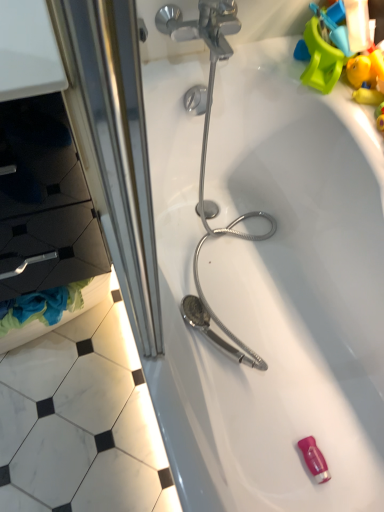
At what (x,y) coordinates should I click in order to perform the action: click on white glossy bathtub at center. Please return your answer as a coordinate pair (x, y). Looking at the image, I should click on (270, 286).

What do you see at coordinates (270, 286) in the screenshot?
I see `white glossy bathtub at center` at bounding box center [270, 286].

In order to face black matte drawer at left, should I rotate leftwards or rightwards?

Turn left by 22.912 degrees to look at black matte drawer at left.

This screenshot has width=384, height=512. Identify the location of black matte drawer at left. (45, 202).

What do you see at coordinates (45, 202) in the screenshot?
I see `black matte drawer at left` at bounding box center [45, 202].

I want to click on white glossy bathtub at center, so click(x=270, y=286).

Is black matte drawer at left to the left or to the right of white glossy bathtub at center in the image?

black matte drawer at left is to the left of white glossy bathtub at center.

Which object is further away from the camera, black matte drawer at left or white glossy bathtub at center?

white glossy bathtub at center is further away from the camera.

Considering the positions of point (30, 157) and point (221, 116), is point (30, 157) closer or farther from the camera than point (221, 116)?

Clearly, point (30, 157) is closer to the camera than point (221, 116).

From the image's perspective, which one is positioned lower, black matte drawer at left or white glossy bathtub at center?

white glossy bathtub at center appears lower in the image.

From a real-world perspective, which is physically below, black matte drawer at left or white glossy bathtub at center?

white glossy bathtub at center.

Does black matte drawer at left have a greater width compared to white glossy bathtub at center?

No, black matte drawer at left is not wider than white glossy bathtub at center.

Looking at this image, can you confirm if black matte drawer at left is taller than white glossy bathtub at center?

Incorrect, the height of black matte drawer at left is not larger of that of white glossy bathtub at center.

Consider the image. Based on their sizes in the image, would you say black matte drawer at left is bigger or smaller than white glossy bathtub at center?

Clearly, black matte drawer at left is smaller in size than white glossy bathtub at center.

Is black matte drawer at left located outside white glossy bathtub at center?

Yes.

Is black matte drawer at left with white glossy bathtub at center?

They are not placed beside each other.

Could you tell me if black matte drawer at left is turned towards white glossy bathtub at center?

No, black matte drawer at left does not turn towards white glossy bathtub at center.

How many degrees apart are the facing directions of black matte drawer at left and white glossy bathtub at center?

The angle between the facing direction of black matte drawer at left and the facing direction of white glossy bathtub at center is 1.58e-05 degrees.

Based on the photo, how far apart are black matte drawer at left and white glossy bathtub at center?

20.19 inches.

Identify the location of drawer in front of the white glossy bathtub at center. (45, 202).

Based on the photo, does white glossy bathtub at center appear on the right side of black matte drawer at left?

Yes, white glossy bathtub at center is to the right of black matte drawer at left.

Which object is further away from the camera taking this photo, white glossy bathtub at center or black matte drawer at left?

white glossy bathtub at center is further from the camera.

Considering the positions of point (200, 228) and point (22, 185), is point (200, 228) closer or farther from the camera than point (22, 185)?

Point (200, 228) appears to be farther away from the viewer than point (22, 185).

From the image's perspective, which is above, white glossy bathtub at center or black matte drawer at left?

black matte drawer at left, from the image's perspective.

From a real-world perspective, which object stands above the other?

black matte drawer at left.

Considering the sizes of objects white glossy bathtub at center and black matte drawer at left in the image provided, who is thinner, white glossy bathtub at center or black matte drawer at left?

→ With smaller width is black matte drawer at left.

Considering the sizes of objects white glossy bathtub at center and black matte drawer at left in the image provided, who is shorter, white glossy bathtub at center or black matte drawer at left?

black matte drawer at left is shorter.

From the picture: Who is smaller, white glossy bathtub at center or black matte drawer at left?

Smaller between the two is black matte drawer at left.

Would you say white glossy bathtub at center is inside or outside black matte drawer at left?

white glossy bathtub at center lies outside black matte drawer at left.

Is white glossy bathtub at center positioned far away from black matte drawer at left?

No, white glossy bathtub at center is in close proximity to black matte drawer at left.

Is white glossy bathtub at center oriented away from black matte drawer at left?

No, white glossy bathtub at center is not facing away from black matte drawer at left.

What's the angular difference between white glossy bathtub at center and black matte drawer at left's facing directions?

1.58e-05 degrees separate the facing orientations of white glossy bathtub at center and black matte drawer at left.

Measure the distance between white glossy bathtub at center and black matte drawer at left.

white glossy bathtub at center is 20.19 inches from black matte drawer at left.

The width and height of the screenshot is (384, 512). Identify the location of drawer in front of the white glossy bathtub at center. (45, 202).

Find the location of a particular element. drawer lying on the left of white glossy bathtub at center is located at coordinates (45, 202).

You are a GUI agent. You are given a task and a screenshot of the screen. Output one action in this format:
    pyautogui.click(x=<x>, y=<y>)
    Task: Click on the bathtub on the right of the black matte drawer at left
    The image size is (384, 512).
    Given the screenshot: What is the action you would take?
    pyautogui.click(x=270, y=286)